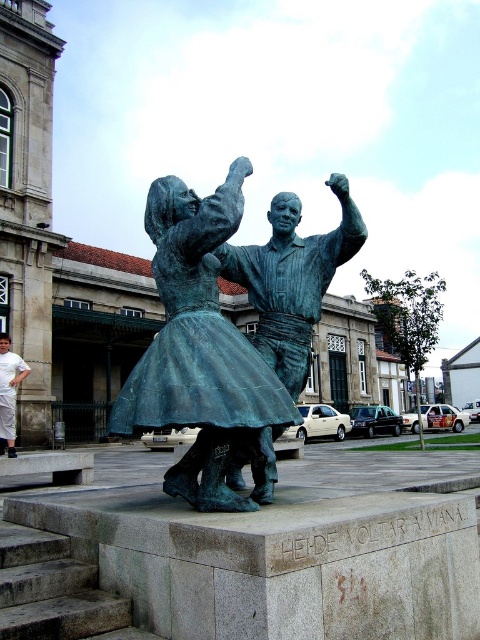
Between bronze statue at center and white cotton pants at lower left, which one appears on the right side from the viewer's perspective?

From the viewer's perspective, bronze statue at center appears more on the right side.

Describe the element at coordinates (199, 348) in the screenshot. The image size is (480, 640). I see `bronze statue at center` at that location.

Does point (200, 308) come in front of point (12, 358)?

Yes, it is in front of point (12, 358).

You are a GUI agent. You are given a task and a screenshot of the screen. Output one action in this format:
    pyautogui.click(x=<x>, y=<y>)
    Task: Click on the bronze statue at center
    
    Given the screenshot: What is the action you would take?
    pyautogui.click(x=199, y=348)

Who is positioned more to the left, gray stone stairs at lower left or white cotton pants at lower left?

Positioned to the left is white cotton pants at lower left.

Identify the location of gray stone stairs at lower left. This screenshot has width=480, height=640. (56, 592).

Does point (21, 630) come behind point (9, 339)?

No, it is not.

The image size is (480, 640). I want to click on gray stone stairs at lower left, so click(x=56, y=592).

Can you confirm if bronze statue at center is shorter than gray stone stairs at lower left?

In fact, bronze statue at center may be taller than gray stone stairs at lower left.

Is point (252, 360) farther from camera compared to point (10, 618)?

That is True.

Is point (143, 406) farther from camera compared to point (116, 605)?

Yes, it is.

This screenshot has height=640, width=480. I want to click on bronze statue at center, so click(x=199, y=348).